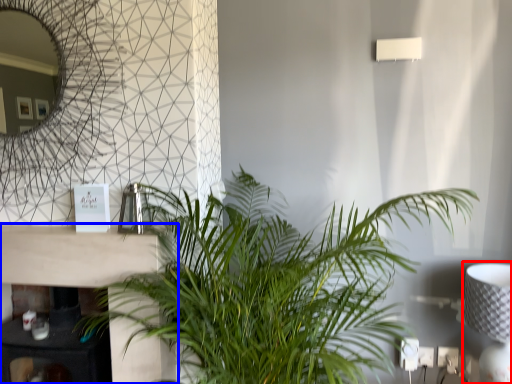
Question: Among these objects, which one is nearest to the camera, table lamp (highlighted by a red box) or table (highlighted by a blue box)?

Choices:
 (A) table lamp
 (B) table

Answer: (A)